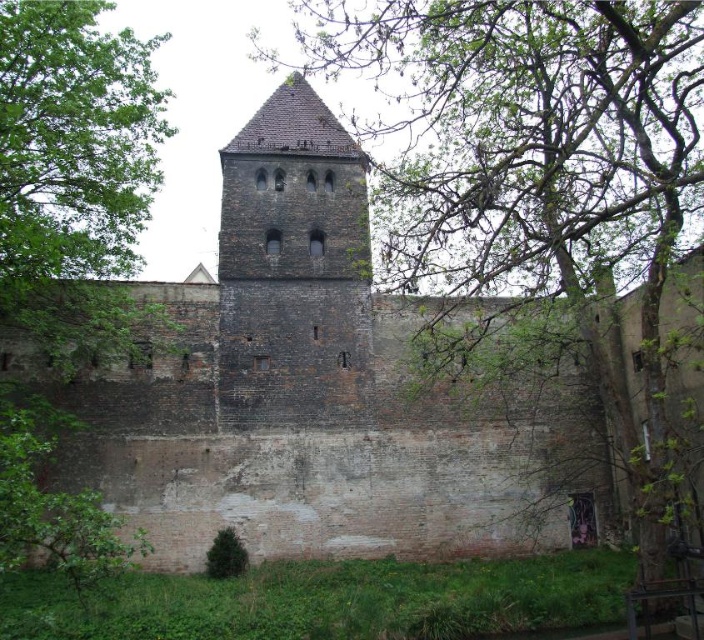
You are a bird flying over a historical stone wall with a central tower. You see a green leafy tree at upper center and a green leafy tree at lower left. Which tree is farther away from the other?

The green leafy tree at upper center is 130.63 feet away from the green leafy tree at lower left, so the tree at upper center is farther away from the tree at lower left.

You are a maintenance worker tasked with trimming a tree that is growing too close to the historical stone wall. You are standing at the base of the green leafy tree at left and need to reach the dark brown stone tower at center to assess the tree growth. Given that your ladder can extend up to 12 meters, will you be able to reach the tower from the tree?

The distance between the green leafy tree at left and the dark brown stone tower at center is 13.56 meters, which exceeds the ladder extension of 12 meters. Therefore, you cannot reach the tower from the tree with the current ladder.

You are standing in front of the historical stone wall and want to take a photo that includes both the green leafy tree at left and the dark brown stone tower at center. Which object should you position closer to the edge of your camera frame to ensure both are fully visible?

You should position the green leafy tree at left closer to the edge of your camera frame since it is closer to the viewer and might otherwise block part of the dark brown stone tower at center if centered.